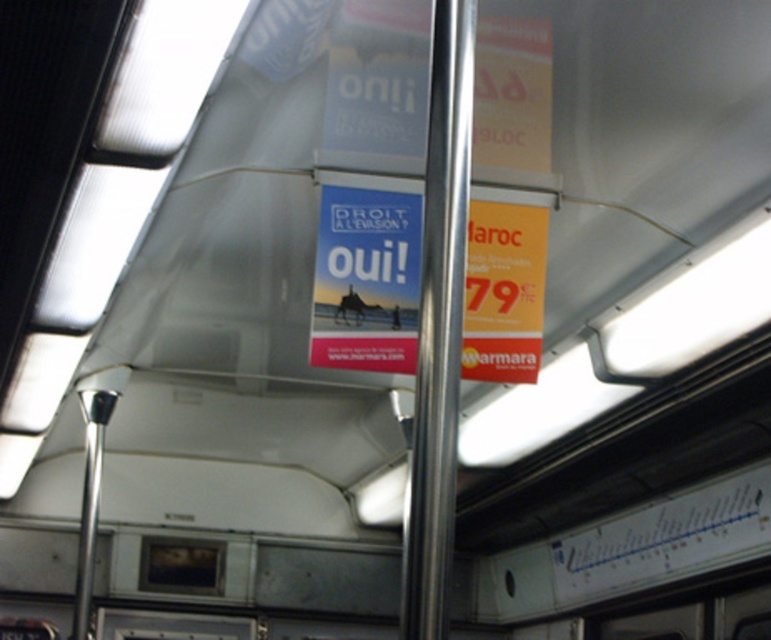
Question: Which point is closer to the camera taking this photo?

Choices:
 (A) (347, 330)
 (B) (421, 369)

Answer: (B)

Question: Does blue paper sign at center have a lesser width compared to polished metal pole at center?

Choices:
 (A) yes
 (B) no

Answer: (B)

Question: Is blue paper sign at center behind polished metal pole at center?

Choices:
 (A) no
 (B) yes

Answer: (B)

Question: Which point is closer to the camera?

Choices:
 (A) (328, 237)
 (B) (446, 3)

Answer: (B)

Question: Can you confirm if blue paper sign at center is positioned below polished metal pole at center?

Choices:
 (A) no
 (B) yes

Answer: (A)